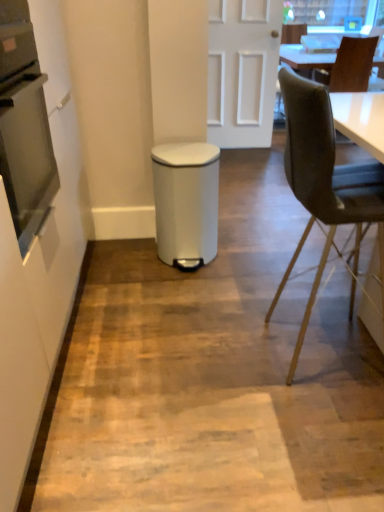
You are a GUI agent. You are given a task and a screenshot of the screen. Output one action in this format:
    pyautogui.click(x=<x>, y=<y>)
    Task: Click on the free spot below velvet black chair at right, positioned as the first chair in front-to-back order (from a real-world perspective)
    
    Given the screenshot: What is the action you would take?
    pyautogui.click(x=320, y=344)